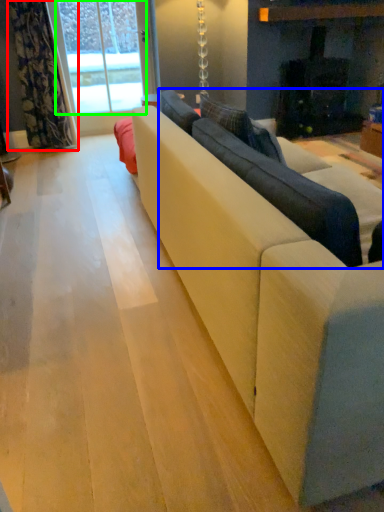
Question: Which is nearer to the curtain (highlighted by a red box)? couch (highlighted by a blue box) or window screen (highlighted by a green box).

Choices:
 (A) couch
 (B) window screen

Answer: (B)